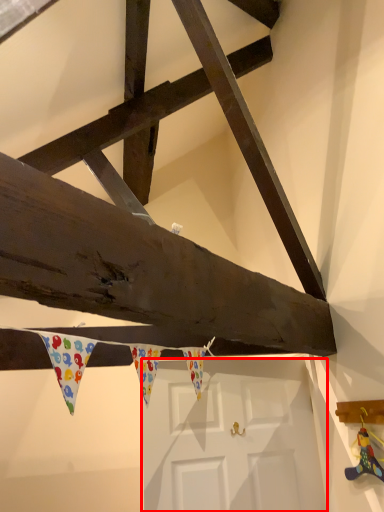
Question: Where is door (annotated by the red box) located in relation to toy in the image?

Choices:
 (A) right
 (B) left

Answer: (B)